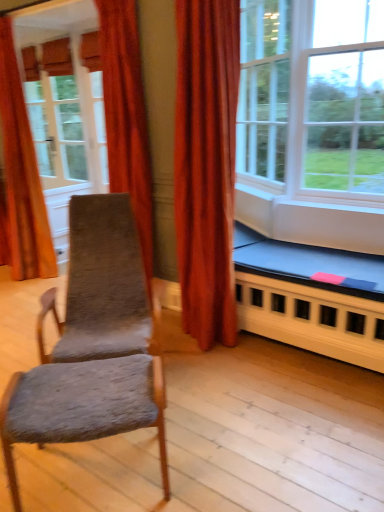
Question: Is white glass window at upper right, which appears as the first window when viewed from the left, not near velvet orange curtain at upper left, the 1th curtain in the front-to-back sequence?

Choices:
 (A) yes
 (B) no

Answer: (A)

Question: Can you confirm if white glass window at upper right, which appears as the first window when viewed from the left, is wider than velvet orange curtain at upper left, the 1th curtain in the front-to-back sequence?

Choices:
 (A) yes
 (B) no

Answer: (B)

Question: From a real-world perspective, is white glass window at upper right, placed as the second window when sorted from right to left, positioned under velvet orange curtain at upper left, the 1th curtain in the front-to-back sequence, based on gravity?

Choices:
 (A) no
 (B) yes

Answer: (B)

Question: Is white glass window at upper right, placed as the second window when sorted from right to left, bigger than velvet orange curtain at upper left, which is the second curtain from left to right?

Choices:
 (A) no
 (B) yes

Answer: (A)

Question: Is velvet orange curtain at upper left, which is the second curtain from left to right, located within white glass window at upper right, placed as the second window when sorted from right to left?

Choices:
 (A) yes
 (B) no

Answer: (B)

Question: From the image's perspective, is velvet orange curtain at upper left, the 1th curtain in the front-to-back sequence, located above or below textured gray fabric rocking chair at left?

Choices:
 (A) below
 (B) above

Answer: (B)

Question: Would you say velvet orange curtain at upper left, which is the second curtain from left to right, is to the left or to the right of textured gray fabric rocking chair at left in the picture?

Choices:
 (A) left
 (B) right

Answer: (A)

Question: Looking at their shapes, would you say velvet orange curtain at upper left, acting as the first curtain starting from the right, is wider or thinner than textured gray fabric rocking chair at left?

Choices:
 (A) thin
 (B) wide

Answer: (A)

Question: Is point tap(144, 134) closer or farther from the camera than point tap(110, 267)?

Choices:
 (A) closer
 (B) farther

Answer: (B)

Question: In terms of width, does clear glass window at center, positioned as the 2th window in left-to-right order, look wider or thinner when compared to velvet orange curtain at upper left, which is the 2th curtain in back-to-front order?

Choices:
 (A) wide
 (B) thin

Answer: (A)

Question: From the image's perspective, is clear glass window at center, positioned as the 2th window in left-to-right order, positioned above or below velvet orange curtain at upper left, the 1th curtain in the front-to-back sequence?

Choices:
 (A) above
 (B) below

Answer: (B)

Question: In terms of size, does clear glass window at center, positioned as the 2th window in left-to-right order, appear bigger or smaller than velvet orange curtain at upper left, the 1th curtain in the front-to-back sequence?

Choices:
 (A) big
 (B) small

Answer: (A)

Question: Visually, is clear glass window at center, marked as the 1th window in a right-to-left arrangement, positioned to the left or to the right of velvet orange curtain at upper left, acting as the first curtain starting from the right?

Choices:
 (A) left
 (B) right

Answer: (B)

Question: From a real-world perspective, is textured gray fabric rocking chair at left above or below white glass window at upper right, which appears as the first window when viewed from the left?

Choices:
 (A) below
 (B) above

Answer: (A)

Question: Is textured gray fabric rocking chair at left inside or outside of white glass window at upper right, placed as the second window when sorted from right to left?

Choices:
 (A) inside
 (B) outside

Answer: (B)